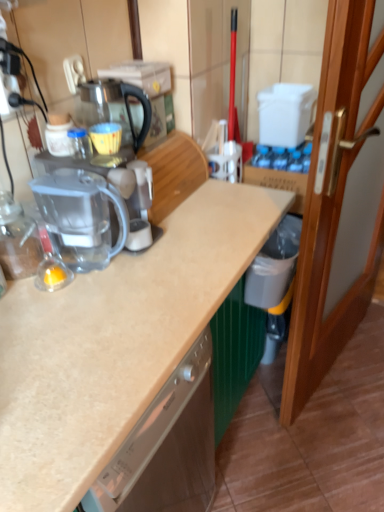
Question: Does transparent plastic blender at left lie in front of transparent plastic coffee machine at center?

Choices:
 (A) yes
 (B) no

Answer: (A)

Question: Is transparent plastic blender at left not within transparent plastic coffee machine at center?

Choices:
 (A) no
 (B) yes

Answer: (B)

Question: Can you confirm if transparent plastic blender at left is shorter than transparent plastic coffee machine at center?

Choices:
 (A) yes
 (B) no

Answer: (B)

Question: Is transparent plastic blender at left at the left side of transparent plastic coffee machine at center?

Choices:
 (A) no
 (B) yes

Answer: (B)

Question: Does transparent plastic blender at left have a larger size compared to transparent plastic coffee machine at center?

Choices:
 (A) yes
 (B) no

Answer: (B)

Question: From the image's perspective, is transparent plastic blender at left positioned above or below wooden door at right?

Choices:
 (A) below
 (B) above

Answer: (A)

Question: In terms of width, does transparent plastic blender at left look wider or thinner when compared to wooden door at right?

Choices:
 (A) wide
 (B) thin

Answer: (A)

Question: Does point coord(48,185) appear closer or farther from the camera than point coord(317,237)?

Choices:
 (A) farther
 (B) closer

Answer: (B)

Question: Considering the relative positions of transparent plastic blender at left and wooden door at right in the image provided, is transparent plastic blender at left to the left or to the right of wooden door at right?

Choices:
 (A) right
 (B) left

Answer: (B)

Question: Based on their sizes in the image, would you say white plastic electric outlet at upper left is bigger or smaller than wooden door at right?

Choices:
 (A) big
 (B) small

Answer: (B)

Question: Relative to wooden door at right, is white plastic electric outlet at upper left in front or behind?

Choices:
 (A) behind
 (B) front

Answer: (A)

Question: In the image, is white plastic electric outlet at upper left on the left side or the right side of wooden door at right?

Choices:
 (A) right
 (B) left

Answer: (B)

Question: Considering the positions of point (79, 62) and point (289, 334), is point (79, 62) closer or farther from the camera than point (289, 334)?

Choices:
 (A) closer
 (B) farther

Answer: (A)

Question: Looking at the image, does transparent glass coffeepot at center seem bigger or smaller compared to wooden door at right?

Choices:
 (A) small
 (B) big

Answer: (A)

Question: Considering the relative positions of transparent glass coffeepot at center and wooden door at right in the image provided, is transparent glass coffeepot at center to the left or to the right of wooden door at right?

Choices:
 (A) left
 (B) right

Answer: (A)